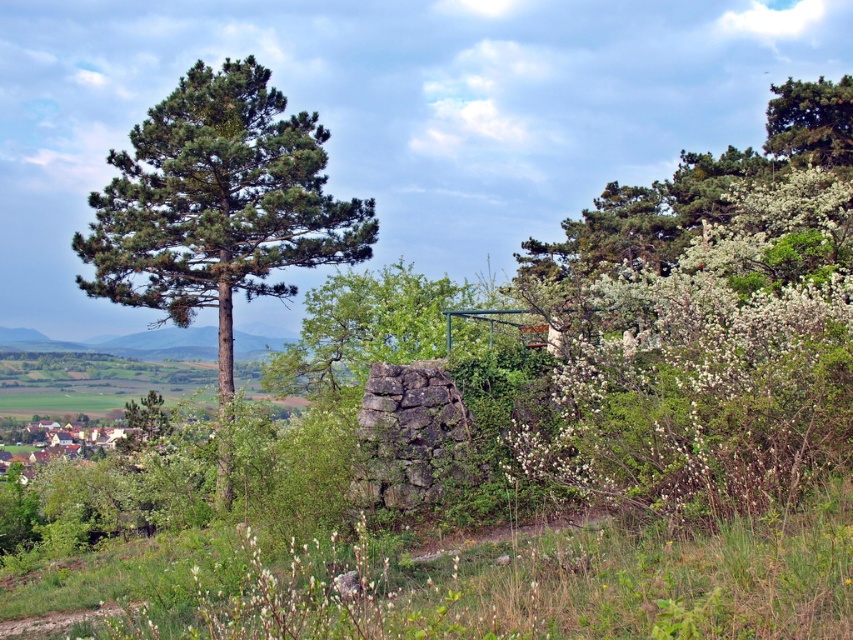
Is green leafy tree at center positioned behind green needle-like at upper right?

No, green leafy tree at center is closer to the viewer.

Looking at this image, is green leafy tree at center closer to the viewer compared to green needle-like at upper right?

Yes, it is in front of green needle-like at upper right.

At what (x,y) coordinates should I click in order to perform the action: click on green leafy tree at center. Please return your answer as a coordinate pair (x, y). This screenshot has width=853, height=640. Looking at the image, I should click on (367, 326).

How much distance is there between green needle-like at left and green needle-like at upper right?

The distance of green needle-like at left from green needle-like at upper right is 20.98 meters.

Can you confirm if green needle-like at left is shorter than green needle-like at upper right?

No.

Between point (262, 184) and point (834, 115), which one is positioned behind?

The point (834, 115) is more distant.

This screenshot has width=853, height=640. Find the location of `green needle-like at left`. green needle-like at left is located at coordinates (218, 211).

Is green needle-like at left taller than green leafy tree at center?

Yes, green needle-like at left is taller than green leafy tree at center.

Who is higher up, green needle-like at left or green leafy tree at center?

green needle-like at left is higher up.

Who is more forward, (201, 150) or (376, 346)?

Positioned in front is point (376, 346).

Identify the location of green needle-like at left. (218, 211).